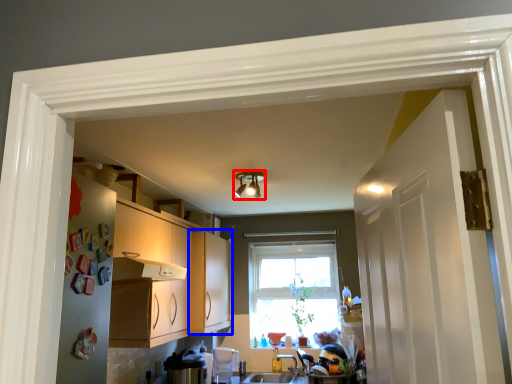
Question: Which object appears closest to the camera in this image, light fixture (highlighted by a red box) or cabinetry (highlighted by a blue box)?

Choices:
 (A) light fixture
 (B) cabinetry

Answer: (A)